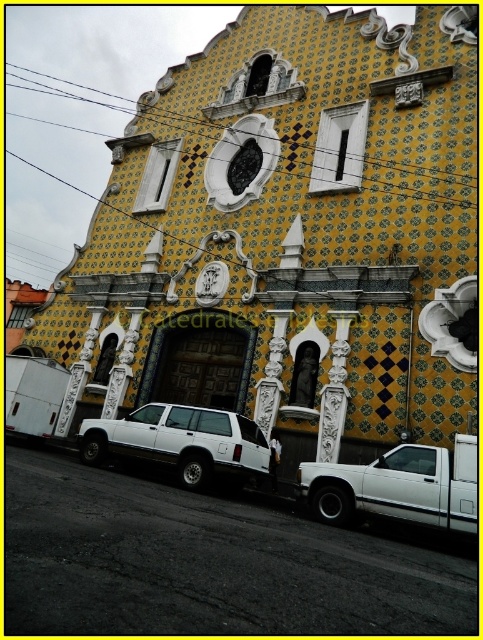
Which is behind, point (225, 141) or point (246, 452)?

Positioned behind is point (225, 141).

Is point (364, 353) closer to camera compared to point (97, 419)?

Yes, point (364, 353) is in front of point (97, 419).

This screenshot has height=640, width=483. In order to click on yellow mosaic tile church at center in this screenshot , I will do (287, 237).

Identify the location of yellow mosaic tile church at center. (287, 237).

From the picture: Who is more forward, (410, 76) or (356, 499)?

Point (356, 499)

Is point (444, 125) farther from viewer compared to point (472, 481)?

Yes, point (444, 125) is behind point (472, 481).

At what (x,y) coordinates should I click in order to perform the action: click on yellow mosaic tile church at center. Please return your answer as a coordinate pair (x, y). Looking at the image, I should click on (287, 237).

What do you see at coordinates (398, 486) in the screenshot? The width and height of the screenshot is (483, 640). I see `white matte truck at lower right` at bounding box center [398, 486].

Image resolution: width=483 pixels, height=640 pixels. What are the coordinates of `white matte truck at lower right` in the screenshot? It's located at (398, 486).